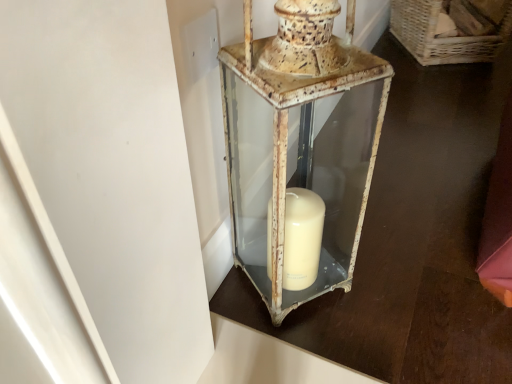
Question: Does woven wicker basket at upper right have a greater height compared to rusty metal lantern at center?

Choices:
 (A) no
 (B) yes

Answer: (A)

Question: Are woven wicker basket at upper right and rusty metal lantern at center beside each other?

Choices:
 (A) yes
 (B) no

Answer: (B)

Question: From a real-world perspective, is woven wicker basket at upper right on top of rusty metal lantern at center?

Choices:
 (A) no
 (B) yes

Answer: (A)

Question: From the image's perspective, would you say woven wicker basket at upper right is positioned over rusty metal lantern at center?

Choices:
 (A) yes
 (B) no

Answer: (A)

Question: From a real-world perspective, is woven wicker basket at upper right beneath rusty metal lantern at center?

Choices:
 (A) no
 (B) yes

Answer: (B)

Question: Considering the relative sizes of woven wicker basket at upper right and rusty metal lantern at center in the image provided, is woven wicker basket at upper right wider than rusty metal lantern at center?

Choices:
 (A) yes
 (B) no

Answer: (A)

Question: Is rusty metal lantern at center in front of woven wicker basket at upper right?

Choices:
 (A) no
 (B) yes

Answer: (B)

Question: Does rusty metal lantern at center appear on the right side of woven wicker basket at upper right?

Choices:
 (A) no
 (B) yes

Answer: (A)

Question: Does rusty metal lantern at center appear on the left side of woven wicker basket at upper right?

Choices:
 (A) no
 (B) yes

Answer: (B)

Question: From the image's perspective, is rusty metal lantern at center on woven wicker basket at upper right?

Choices:
 (A) yes
 (B) no

Answer: (B)

Question: Does rusty metal lantern at center have a greater height compared to woven wicker basket at upper right?

Choices:
 (A) no
 (B) yes

Answer: (B)

Question: Is rusty metal lantern at center smaller than woven wicker basket at upper right?

Choices:
 (A) yes
 (B) no

Answer: (A)

Question: Based on their positions, is woven wicker basket at upper right located to the left or right of rusty metal lantern at center?

Choices:
 (A) left
 (B) right

Answer: (B)